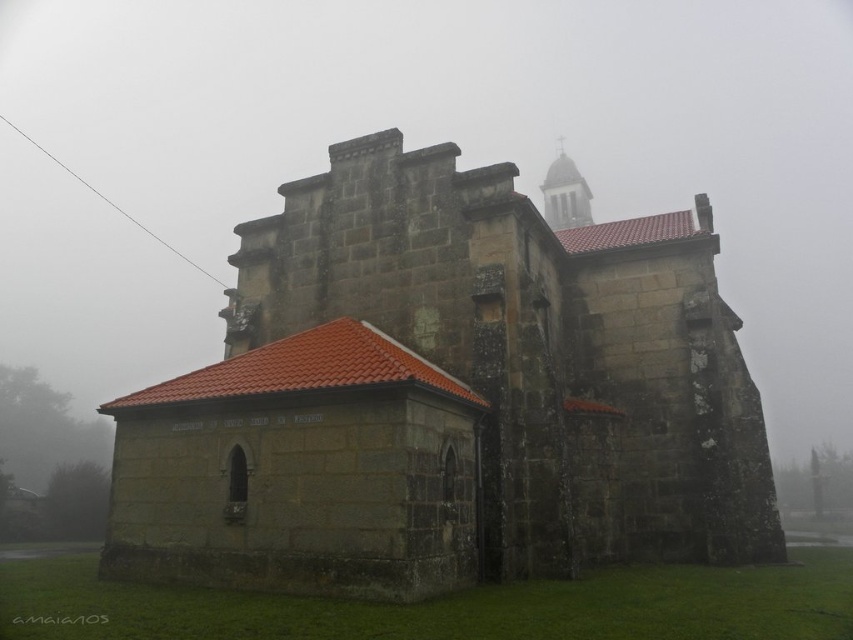
Question: Is dark stone church at center positioned before smooth stone tower at upper center?

Choices:
 (A) yes
 (B) no

Answer: (A)

Question: Is dark stone church at center positioned at the back of smooth stone tower at upper center?

Choices:
 (A) yes
 (B) no

Answer: (B)

Question: Can you confirm if dark stone church at center is positioned below smooth stone tower at upper center?

Choices:
 (A) no
 (B) yes

Answer: (B)